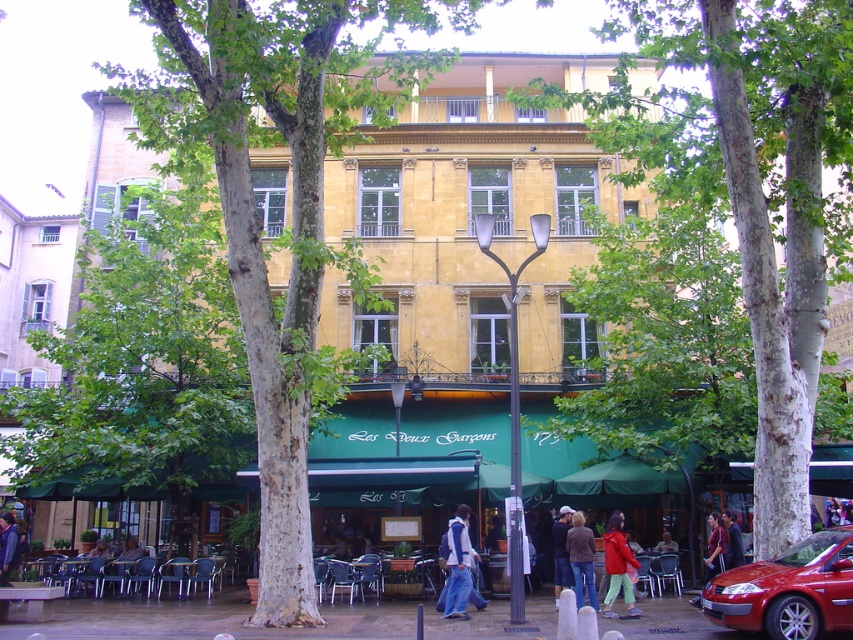
You are a customer at the cafe and want to sit between the denim jacket at lower center and the dark brown leather jacket at center. Can you sit comfortably between them?

The denim jacket at lower center might be wider than dark brown leather jacket at center, so there might not be enough space for you to sit comfortably between them.

Looking at this image, you are a customer entering the cafe and see the denim jacket at lower center and the dark brown leather jacket at center. Which jacket is closer to the entrance?

The denim jacket at lower center is closer to the entrance because it is located above the dark brown leather jacket at center, indicating it is positioned higher up near the entrance area.